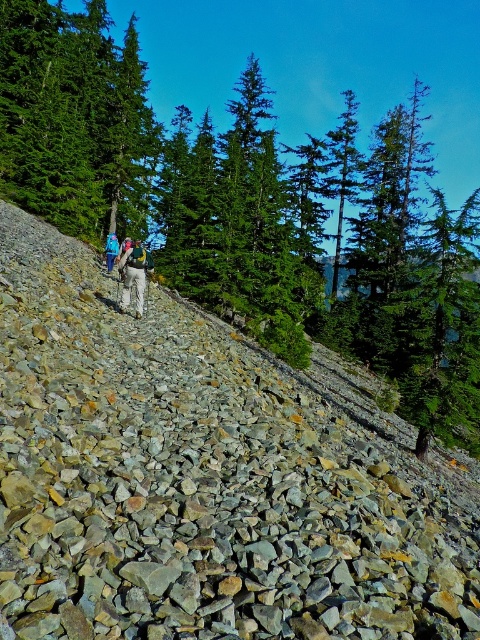
Can you confirm if green evergreen tree at upper center is wider than blue fabric backpack at center?

Yes, green evergreen tree at upper center is wider than blue fabric backpack at center.

Is green evergreen tree at upper center above blue fabric backpack at center?

Yes, green evergreen tree at upper center is above blue fabric backpack at center.

Which is in front, point (29, 148) or point (116, 246)?

Point (116, 246) is more forward.

Identify the location of green evergreen tree at upper center. The image size is (480, 640). (216, 198).

Is green evergreen tree at upper center smaller than khaki pants at center?

No.

Is green evergreen tree at upper center closer to camera compared to khaki pants at center?

No, green evergreen tree at upper center is behind khaki pants at center.

Describe the element at coordinates (216, 198) in the screenshot. The height and width of the screenshot is (640, 480). I see `green evergreen tree at upper center` at that location.

At what (x,y) coordinates should I click in order to perform the action: click on green evergreen tree at upper center. Please return your answer as a coordinate pair (x, y). Image resolution: width=480 pixels, height=640 pixels. Looking at the image, I should click on (216, 198).

Does khaki pants at center have a greater height compared to blue fabric backpack at center?

Incorrect, khaki pants at center's height is not larger of blue fabric backpack at center's.

This screenshot has height=640, width=480. I want to click on khaki pants at center, so click(134, 275).

Find the location of `khaki pants at center`. khaki pants at center is located at coordinates (134, 275).